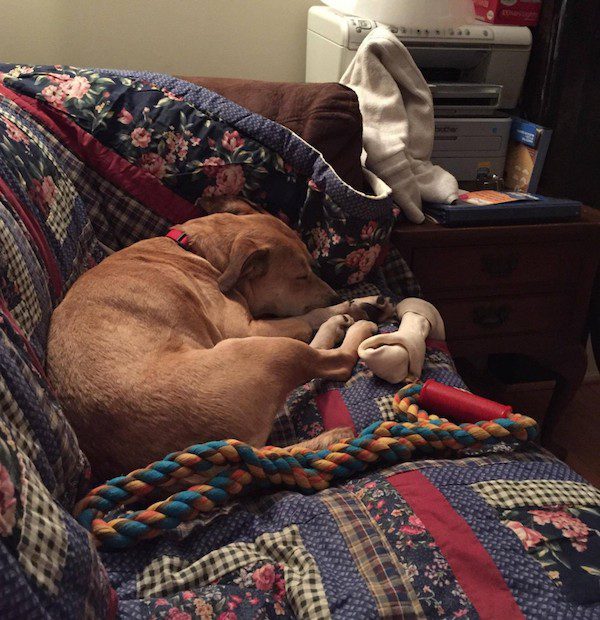
This screenshot has height=620, width=600. In order to click on patchwork quilt in this screenshot , I will do `click(400, 526)`.